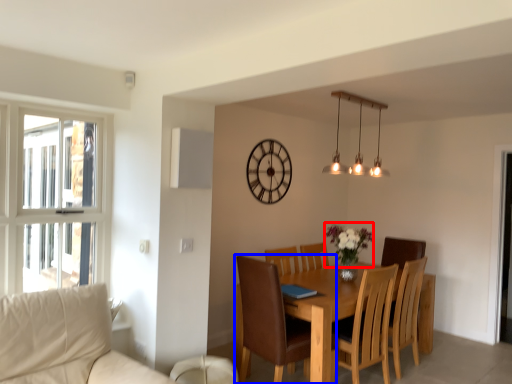
Question: Which of the following is the farthest to the observer, flower (highlighted by a red box) or chair (highlighted by a blue box)?

Choices:
 (A) flower
 (B) chair

Answer: (A)